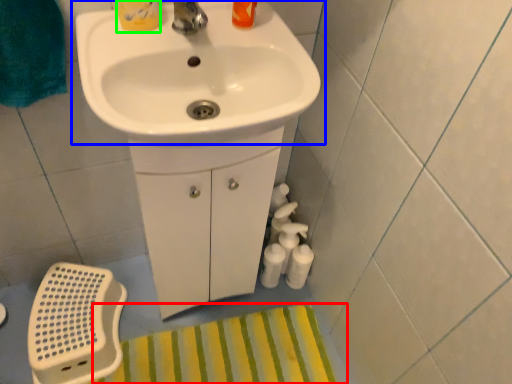
Question: Which is nearer to the bath mat (highlighted by a red box)? sink (highlighted by a blue box) or toiletry (highlighted by a green box).

Choices:
 (A) sink
 (B) toiletry

Answer: (A)